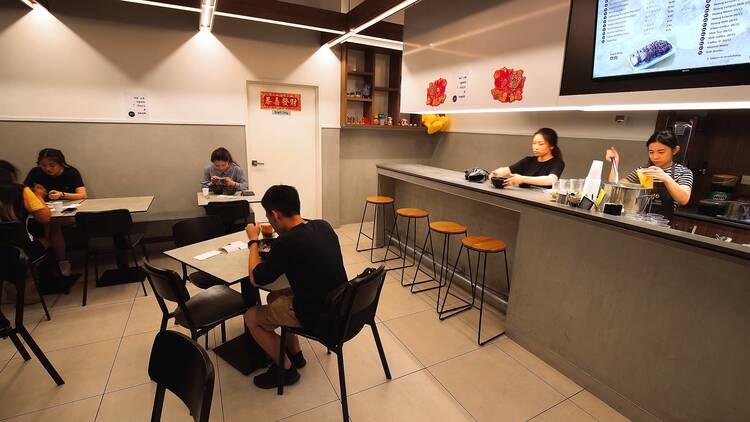
This screenshot has height=422, width=750. Find the location of `empty plastic cups`. empty plastic cups is located at coordinates (597, 170), (579, 185), (561, 183), (636, 218), (634, 211), (652, 214), (664, 220), (664, 225).